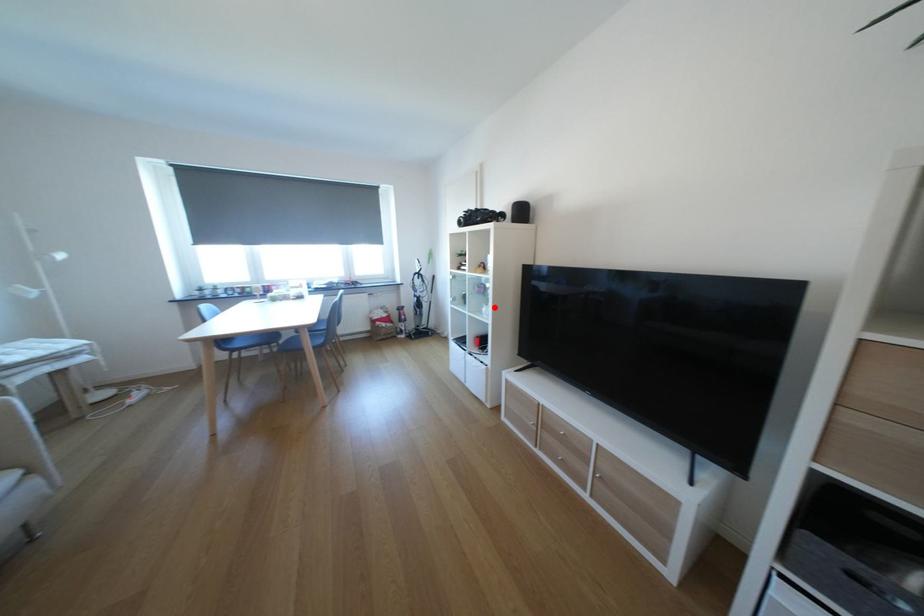
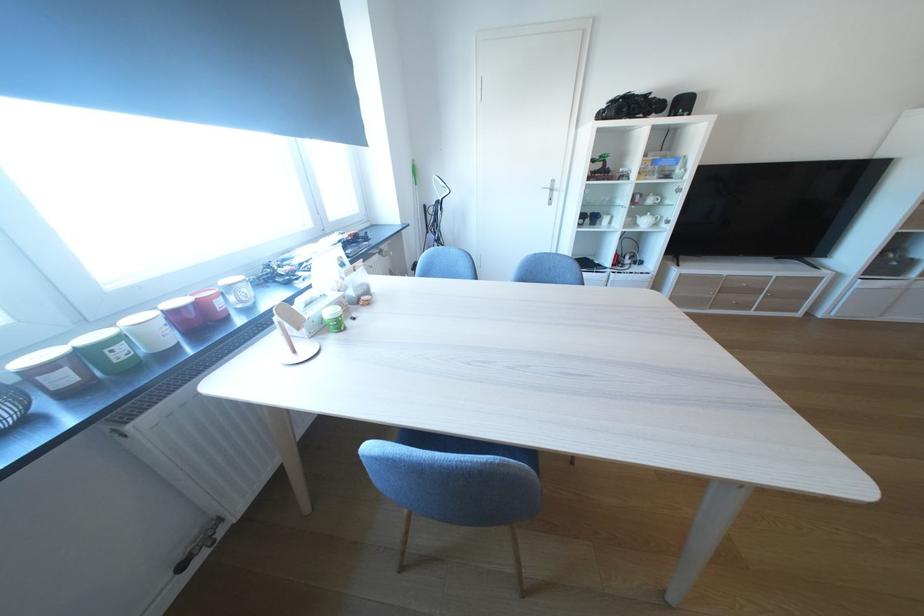
Question: A red point is marked in image1. In image2, is the corresponding 3D point closer to the camera or farther? Reply with the corresponding letter.

Choices:
 (A) The corresponding 3D point is closer.
 (B) The corresponding 3D point is farther.

Answer: (A)